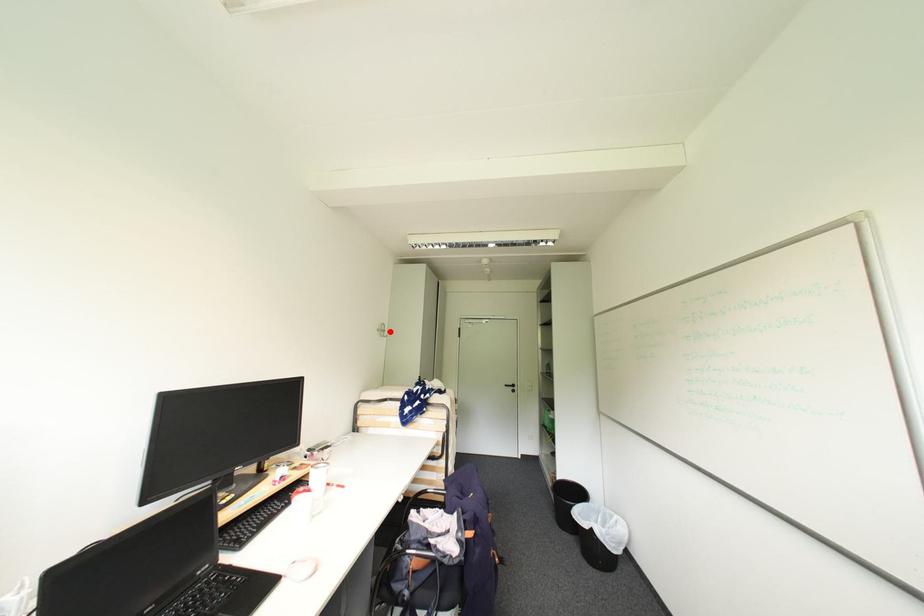
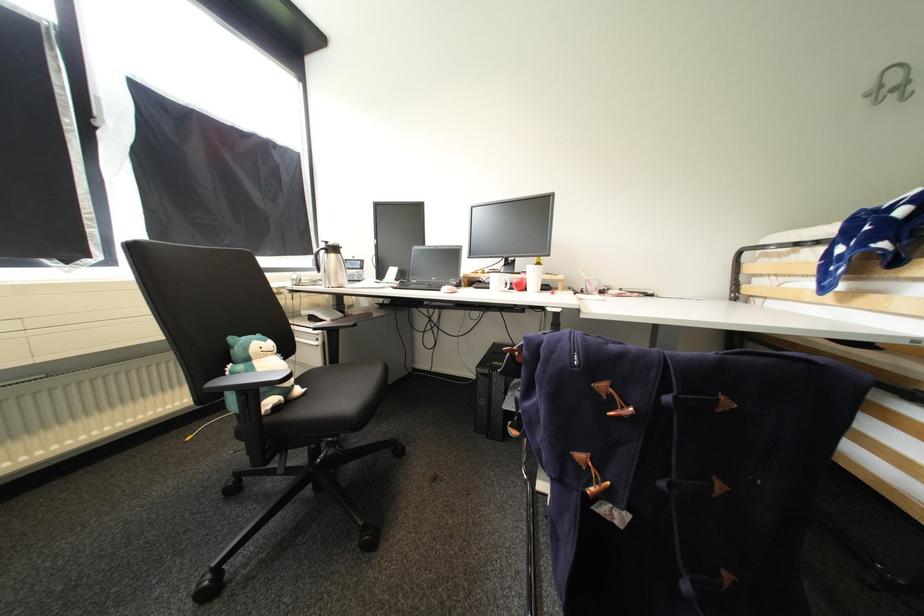
The point at the highlighted location is marked in the first image. Where is the corresponding point in the second image?

(912, 84)